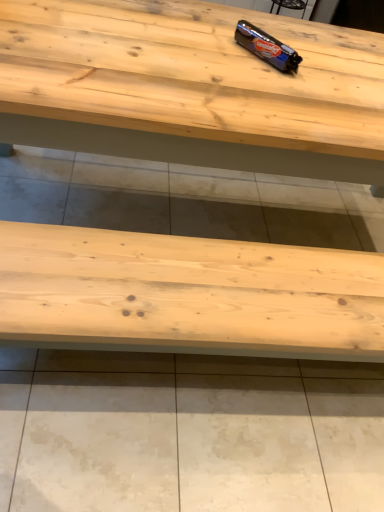
Identify the location of free space that is to the left of shiny metallic chocolate bar at upper center. The height and width of the screenshot is (512, 384). (214, 40).